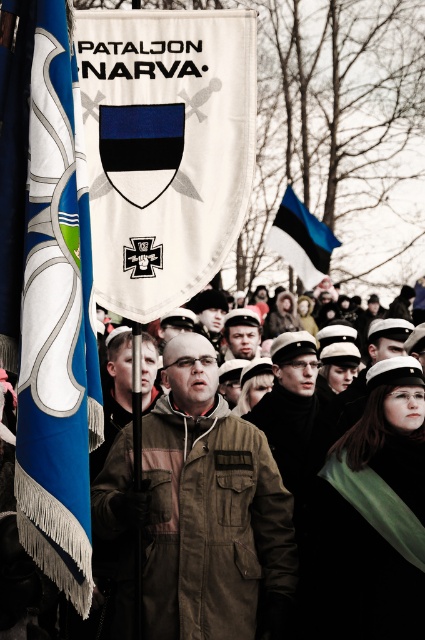
Question: Which object appears farthest from the camera in this image?

Choices:
 (A) white fabric banner at center
 (B) brown suede jacket at center

Answer: (B)

Question: Which object is positioned closest to the blue fringed flag at left?

Choices:
 (A) matte black uniform at center
 (B) blue-white-black flag at upper right

Answer: (A)

Question: Can you confirm if white fabric banner at center is positioned to the right of brown suede jacket at center?

Choices:
 (A) no
 (B) yes

Answer: (B)

Question: Considering the relative positions of blue fringed flag at left and matte black uniform at center in the image provided, where is blue fringed flag at left located with respect to matte black uniform at center?

Choices:
 (A) left
 (B) right

Answer: (A)

Question: Is white fabric banner at center smaller than brown suede jacket at center?

Choices:
 (A) yes
 (B) no

Answer: (A)

Question: Which is nearer to the blue-white-black flag at upper right?

Choices:
 (A) blue fringed flag at left
 (B) brown suede jacket at center
 (C) matte black uniform at center

Answer: (C)